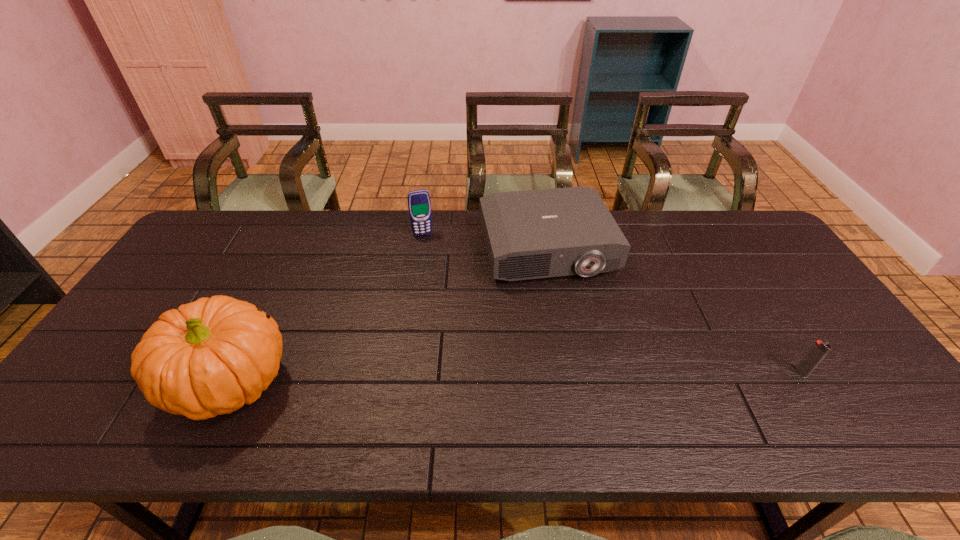
The height and width of the screenshot is (540, 960). In order to click on free space that is in between the rightmost object and the second tallest object in this screenshot , I will do `click(612, 303)`.

Image resolution: width=960 pixels, height=540 pixels. In order to click on empty space that is in between the leftmost object and the projector in this screenshot , I will do `click(390, 315)`.

This screenshot has width=960, height=540. Find the location of `vacant area that lies between the projector and the rightmost object`. vacant area that lies between the projector and the rightmost object is located at coordinates (674, 310).

You are a GUI agent. You are given a task and a screenshot of the screen. Output one action in this format:
    pyautogui.click(x=<x>, y=<y>)
    Task: Click on the free area in between the third shortest object and the igniter
    This screenshot has width=960, height=540.
    Given the screenshot: What is the action you would take?
    pyautogui.click(x=612, y=303)

Locate which object is the third closest to the projector. Please provide its 2D coordinates. Your answer should be formatted as a tuple, i.e. [(x, y)], where the tuple contains the x and y coordinates of a point satisfying the conditions above.

[(212, 356)]

Point out which object is positioned as the third nearest to the rightmost object. Please provide its 2D coordinates. Your answer should be formatted as a tuple, i.e. [(x, y)], where the tuple contains the x and y coordinates of a point satisfying the conditions above.

[(212, 356)]

The height and width of the screenshot is (540, 960). Identify the location of free location that satisfies the following two spatial constraints: 1. on the front side of the rightmost object; 2. on the right side of the cellular telephone. (401, 372).

Locate an element on the screen. free space that satisfies the following two spatial constraints: 1. on the front side of the third shortest object; 2. on the left side of the second object from right to left is located at coordinates (420, 248).